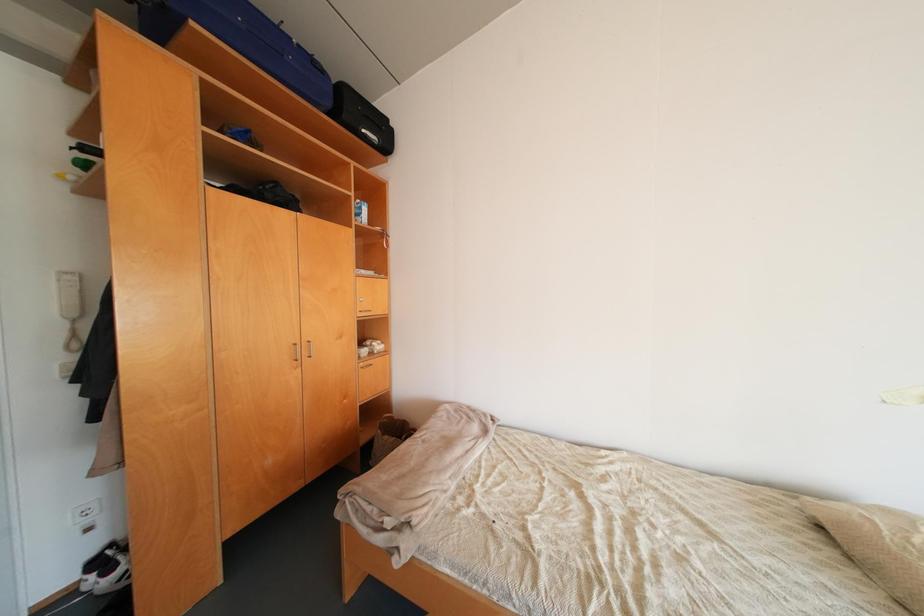
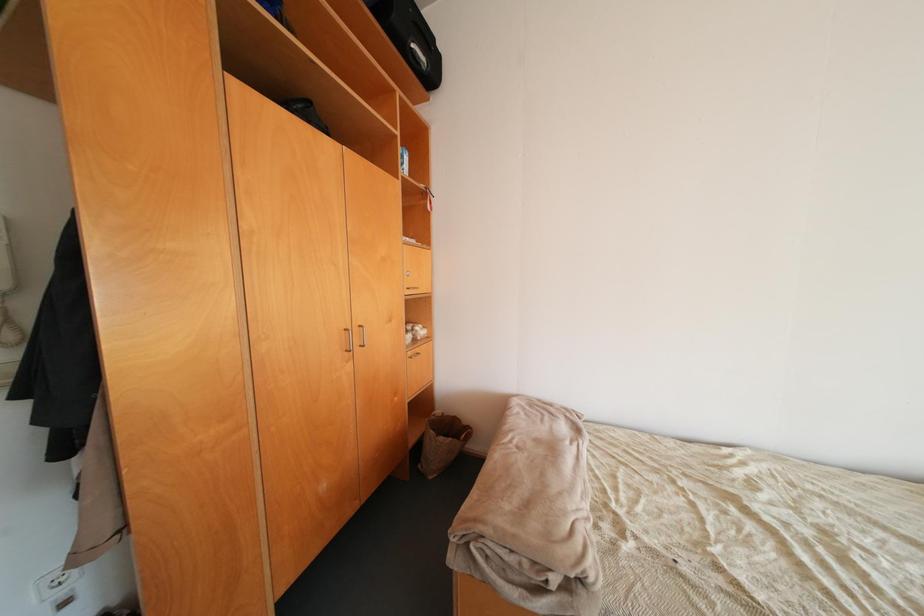
Question: The camera is either moving clockwise (left) or counter-clockwise (right) around the object. The first image is from the beginning of the video and the second image is from the end. Is the camera moving left or right when shooting the video?

Choices:
 (A) Left
 (B) Right

Answer: (A)